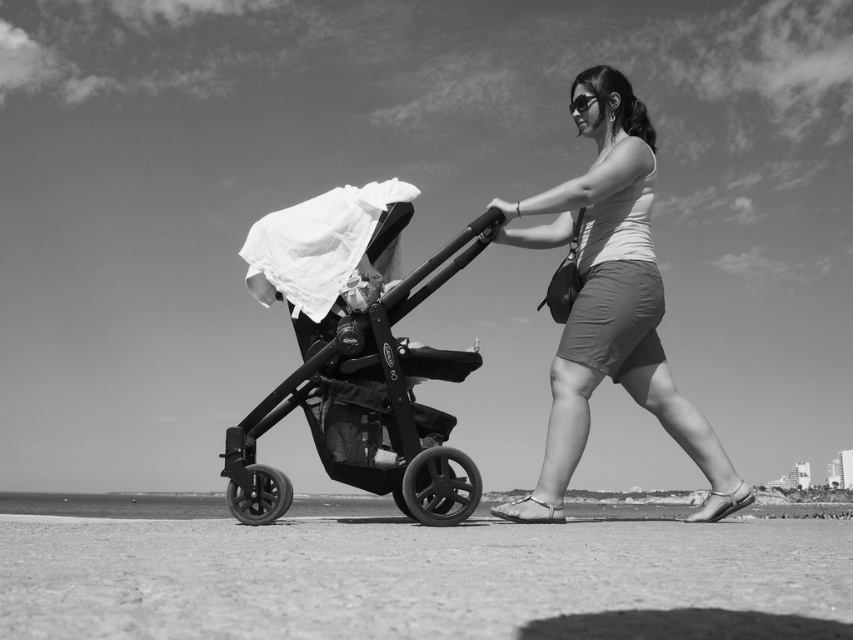
Is black matte baby carriage at center thinner than matte white tank top at center?

Correct, black matte baby carriage at center's width is less than matte white tank top at center's.

Consider the image. Can you confirm if black matte baby carriage at center is taller than matte white tank top at center?

Incorrect, black matte baby carriage at center's height is not larger of matte white tank top at center's.

Measure the distance between black matte baby carriage at center and camera.

black matte baby carriage at center and camera are 6.79 meters apart from each other.

Where is `black matte baby carriage at center`? This screenshot has height=640, width=853. black matte baby carriage at center is located at coordinates (358, 364).

Can you confirm if smooth sand at lower center is positioned to the right of matte white tank top at center?

No, smooth sand at lower center is not to the right of matte white tank top at center.

Is point (187, 557) positioned in front of point (631, 273)?

Yes, point (187, 557) is in front of point (631, 273).

Locate an element on the screen. The image size is (853, 640). smooth sand at lower center is located at coordinates (422, 579).

Does smooth sand at lower center appear on the left side of black matte baby carriage at center?

Correct, you'll find smooth sand at lower center to the left of black matte baby carriage at center.

Does smooth sand at lower center appear under black matte baby carriage at center?

Yes, smooth sand at lower center is below black matte baby carriage at center.

Is point (195, 596) closer to camera compared to point (502, 221)?

That is True.

Identify the location of smooth sand at lower center. (422, 579).